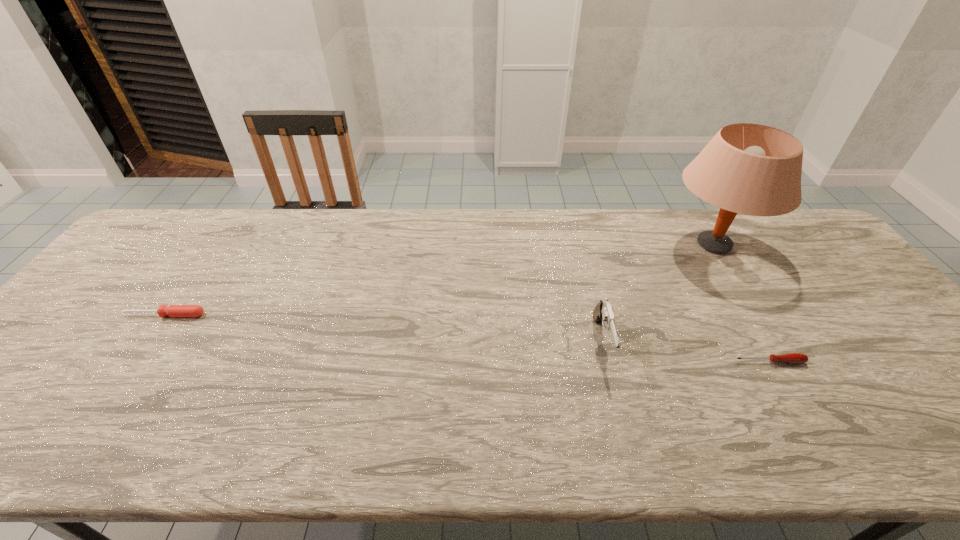
Locate which object ranks second in proximity to the farther screwdriver. Please provide its 2D coordinates. Your answer should be formatted as a tuple, i.e. [(x, y)], where the tuple contains the x and y coordinates of a point satisfying the conditions above.

[(751, 169)]

Locate an element on the screen. vacant space that satisfies the following two spatial constraints: 1. on the front-facing side of the lampshade; 2. at the muzzle of the gun is located at coordinates coord(773,341).

Where is `free point that satisfies the following two spatial constraints: 1. on the front-facing side of the tallest object; 2. at the muzzle of the third object from right to left`? Image resolution: width=960 pixels, height=540 pixels. free point that satisfies the following two spatial constraints: 1. on the front-facing side of the tallest object; 2. at the muzzle of the third object from right to left is located at coordinates (773, 341).

At what (x,y) coordinates should I click in order to perform the action: click on vacant space that satisfies the following two spatial constraints: 1. on the front-facing side of the tallest object; 2. at the muzzle of the second object from left to right. Please return your answer as a coordinate pair (x, y). Looking at the image, I should click on (773, 341).

At what (x,y) coordinates should I click in order to perform the action: click on vacant space that satisfies the following two spatial constraints: 1. on the front side of the right screwdriver; 2. on the right side of the farther screwdriver. Please return your answer as a coordinate pair (x, y). This screenshot has width=960, height=540. Looking at the image, I should click on [132, 362].